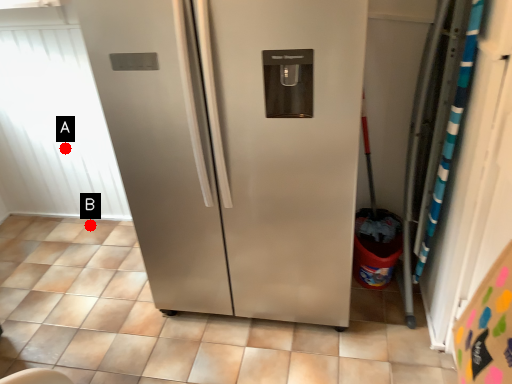
Question: Two points are circled on the image, labeled by A and B beside each circle. Which point is farther to the camera?

Choices:
 (A) A is further
 (B) B is further

Answer: (B)